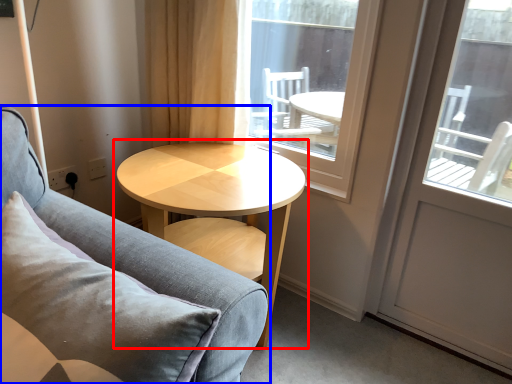
Question: Among these objects, which one is farthest to the camera, coffee table (highlighted by a red box) or studio couch (highlighted by a blue box)?

Choices:
 (A) coffee table
 (B) studio couch

Answer: (A)